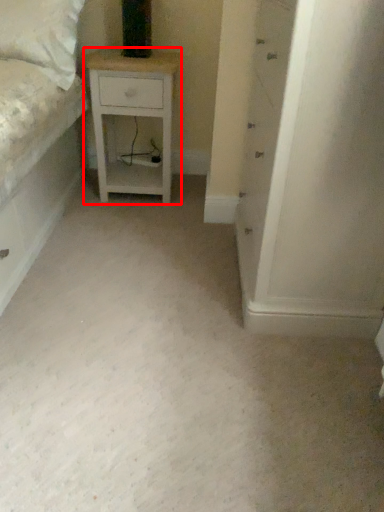
Question: Where is nightstand (annotated by the red box) located in relation to chest of drawers in the image?

Choices:
 (A) right
 (B) left

Answer: (B)